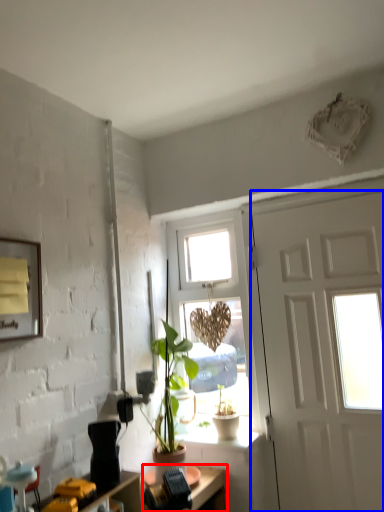
Question: Which object appears farthest to the camera in this image, desk (highlighted by a red box) or door (highlighted by a blue box)?

Choices:
 (A) desk
 (B) door

Answer: (B)